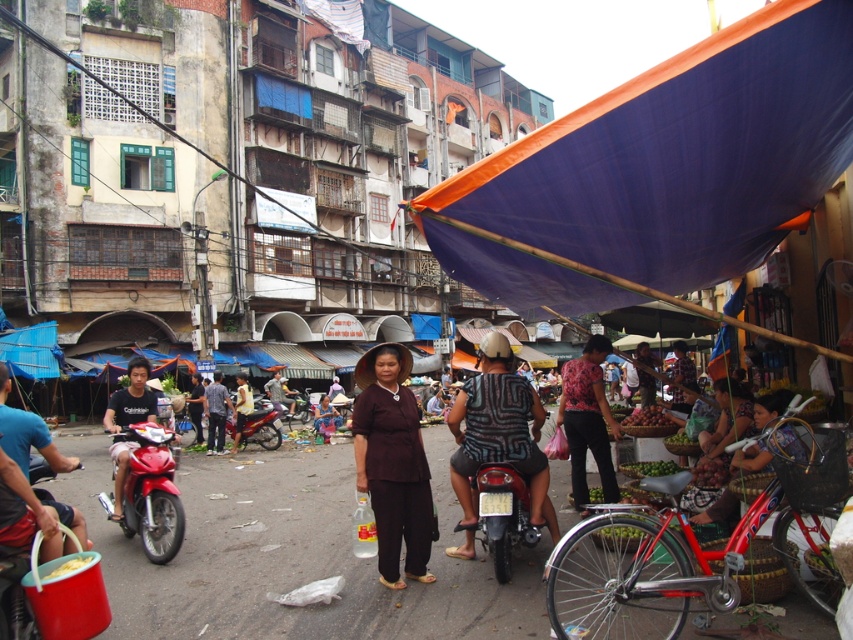
Which of these two, shiny red motorcycle at center-left or shiny black motorcycle at center, stands taller?

shiny red motorcycle at center-left

Is point (167, 465) more distant than point (508, 493)?

Yes.

This screenshot has width=853, height=640. Describe the element at coordinates (151, 492) in the screenshot. I see `shiny red motorcycle at center-left` at that location.

Image resolution: width=853 pixels, height=640 pixels. What are the coordinates of `shiny red motorcycle at center-left` in the screenshot? It's located at (151, 492).

Which is behind, point (374, 497) or point (274, 428)?

Positioned behind is point (274, 428).

Is point (357, 397) less distant than point (268, 449)?

Yes, point (357, 397) is closer to viewer.

Does point (413, 484) lie behind point (277, 428)?

No, it is in front of (277, 428).

Locate an element on the screen. The image size is (853, 640). brown matte dress at center is located at coordinates (392, 461).

Consider the image. Is brown matte dress at center thinner than patterned fabric shirt at center?

Indeed, brown matte dress at center has a lesser width compared to patterned fabric shirt at center.

Describe the element at coordinates (392, 461) in the screenshot. I see `brown matte dress at center` at that location.

Locate an element on the screen. The width and height of the screenshot is (853, 640). brown matte dress at center is located at coordinates (392, 461).